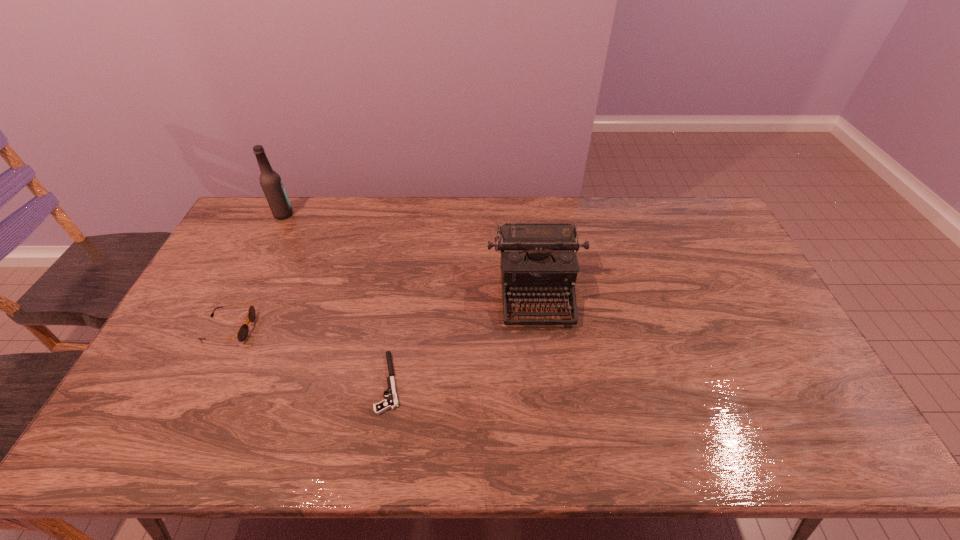
The image size is (960, 540). What are the coordinates of `vacant space located on the front-facing side of the nearest object` in the screenshot? It's located at (325, 382).

Where is `free spot located on the front-facing side of the nearest object`? The width and height of the screenshot is (960, 540). free spot located on the front-facing side of the nearest object is located at coordinates (260, 382).

Locate an element on the screen. vacant position located 0.270m on the front-facing side of the nearest object is located at coordinates (x=276, y=382).

This screenshot has width=960, height=540. Find the location of `object that is at the far edge`. object that is at the far edge is located at coordinates (270, 181).

The width and height of the screenshot is (960, 540). I want to click on beer bottle located at the left edge, so click(270, 181).

In order to click on sunglasses at the left edge in this screenshot , I will do click(x=242, y=334).

Identify the location of object present at the far left corner. coord(270,181).

The image size is (960, 540). What are the coordinates of `vacant space at the far edge of the desktop` in the screenshot? It's located at (572, 201).

The width and height of the screenshot is (960, 540). Identify the location of free space at the near edge. (358, 447).

At what (x,y) coordinates should I click in order to perform the action: click on vacant space at the left edge of the desktop. Please return your answer as a coordinate pair (x, y). The width and height of the screenshot is (960, 540). Looking at the image, I should click on (212, 343).